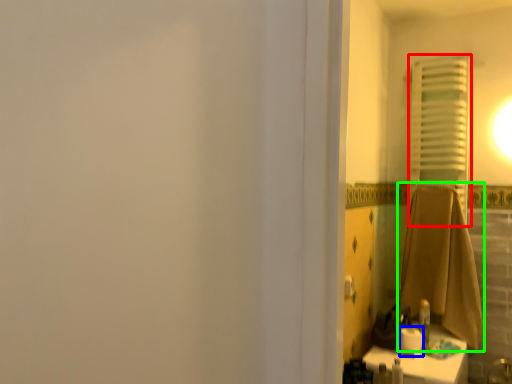
Question: Which object is positioned closest to curtain (highlighted by a red box)? Select from toilet paper (highlighted by a blue box) and bath towel (highlighted by a green box).

Choices:
 (A) toilet paper
 (B) bath towel

Answer: (B)